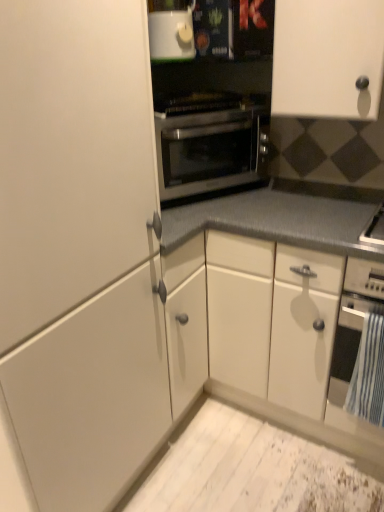
Question: Can you confirm if stainless steel oven at center, the 1th oven viewed from the top, is bigger than white matte cabinet at left, the first cabinetry in the left-to-right sequence?

Choices:
 (A) no
 (B) yes

Answer: (A)

Question: Can you confirm if stainless steel oven at center, marked as the 2th oven in a bottom-to-top arrangement, is shorter than white matte cabinet at left, the first cabinetry in the left-to-right sequence?

Choices:
 (A) no
 (B) yes

Answer: (B)

Question: Considering the relative positions of stainless steel oven at center, the 1th oven viewed from the top, and white matte cabinet at left, the 2th cabinetry positioned from the right, in the image provided, is stainless steel oven at center, the 1th oven viewed from the top, to the right of white matte cabinet at left, the 2th cabinetry positioned from the right, from the viewer's perspective?

Choices:
 (A) no
 (B) yes

Answer: (B)

Question: From the image's perspective, is stainless steel oven at center, which appears as the second oven when viewed from the right, on top of white matte cabinet at left, the first cabinetry in the left-to-right sequence?

Choices:
 (A) no
 (B) yes

Answer: (B)

Question: From the image's perspective, is white matte cabinet at left, the 2th cabinetry positioned from the right, located above or below white matte cabinet at upper right, which appears as the 2th cabinetry when viewed from the left?

Choices:
 (A) above
 (B) below

Answer: (B)

Question: Considering their positions, is white matte cabinet at left, the 2th cabinetry positioned from the right, located in front of or behind white matte cabinet at upper right, marked as the 1th cabinetry in a right-to-left arrangement?

Choices:
 (A) behind
 (B) front

Answer: (B)

Question: Considering the positions of white matte cabinet at left, the 2th cabinetry positioned from the right, and white matte cabinet at upper right, marked as the 1th cabinetry in a right-to-left arrangement, in the image, is white matte cabinet at left, the 2th cabinetry positioned from the right, taller or shorter than white matte cabinet at upper right, marked as the 1th cabinetry in a right-to-left arrangement,?

Choices:
 (A) short
 (B) tall

Answer: (B)

Question: From a real-world perspective, relative to white matte cabinet at upper right, which appears as the 2th cabinetry when viewed from the left, is white matte cabinet at left, the 2th cabinetry positioned from the right, vertically above or below?

Choices:
 (A) above
 (B) below

Answer: (B)

Question: Visually, is stainless steel oven at center, positioned as the first oven in left-to-right order, positioned to the left or to the right of white matte cabinet at left, the first cabinetry in the left-to-right sequence?

Choices:
 (A) left
 (B) right

Answer: (B)

Question: Considering the positions of stainless steel oven at center, which appears as the second oven when viewed from the right, and white matte cabinet at left, the 2th cabinetry positioned from the right, in the image, is stainless steel oven at center, which appears as the second oven when viewed from the right, bigger or smaller than white matte cabinet at left, the 2th cabinetry positioned from the right,?

Choices:
 (A) small
 (B) big

Answer: (A)

Question: Looking at their shapes, would you say stainless steel oven at center, which appears as the second oven when viewed from the right, is wider or thinner than white matte cabinet at left, the first cabinetry in the left-to-right sequence?

Choices:
 (A) wide
 (B) thin

Answer: (B)

Question: From the image's perspective, is stainless steel oven at center, the 1th oven viewed from the top, located above or below white matte cabinet at left, the first cabinetry in the left-to-right sequence?

Choices:
 (A) below
 (B) above

Answer: (B)

Question: Is black matte oven at lower right, arranged as the second oven when viewed from the top, wider or thinner than white glossy microwave at upper center?

Choices:
 (A) wide
 (B) thin

Answer: (A)

Question: From the image's perspective, relative to white glossy microwave at upper center, is black matte oven at lower right, the second oven positioned from the left, above or below?

Choices:
 (A) above
 (B) below

Answer: (B)